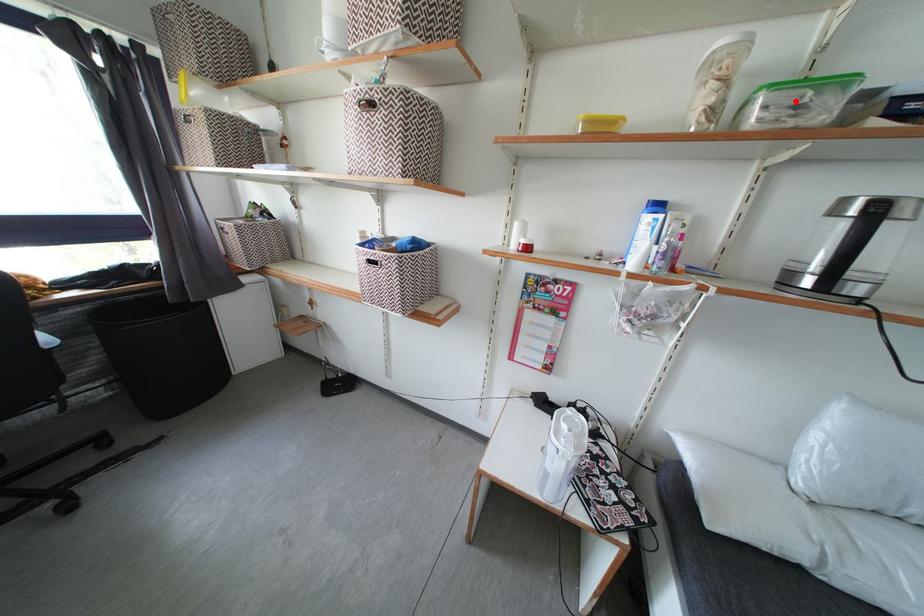
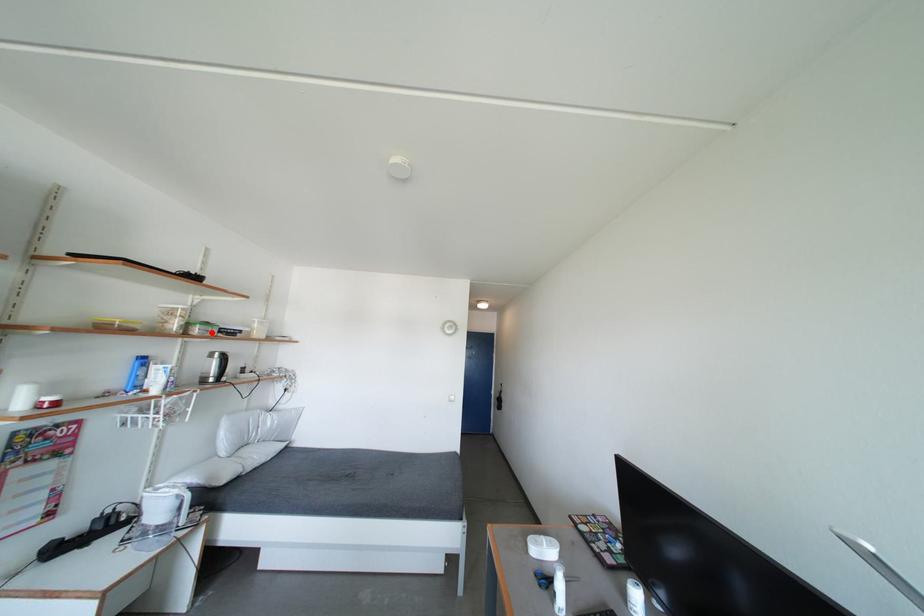
I am providing you with two images of the same scene from different viewpoints. A red point is marked on the first image and another point is marked on the second image. Is the red point in image1 aligned with the point shown in image2?

Yes